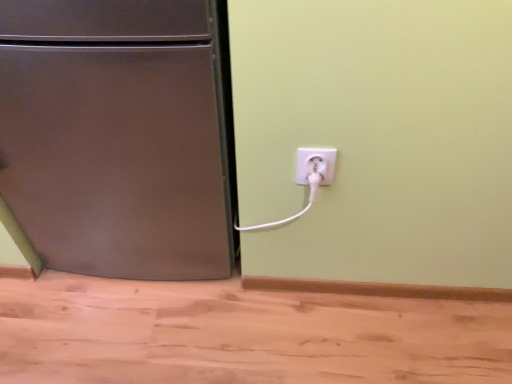
Find the location of a particular element. The height and width of the screenshot is (384, 512). white plastic plug at lower right is located at coordinates (315, 163).

What do you see at coordinates (315, 163) in the screenshot?
I see `white plastic plug at lower right` at bounding box center [315, 163].

Measure the distance between white plastic plug at lower right and camera.

The depth of white plastic plug at lower right is 34.94 inches.

Locate an element on the screen. This screenshot has width=512, height=384. brushed metal refrigerator at left is located at coordinates (116, 136).

Describe the element at coordinates (116, 136) in the screenshot. This screenshot has height=384, width=512. I see `brushed metal refrigerator at left` at that location.

You are a GUI agent. You are given a task and a screenshot of the screen. Output one action in this format:
    pyautogui.click(x=<x>, y=<y>)
    Task: Click on the white plastic plug at lower right
    This screenshot has width=512, height=384.
    Given the screenshot: What is the action you would take?
    pyautogui.click(x=315, y=163)

Based on the photo, can you confirm if brushed metal refrigerator at left is positioned to the right of white plastic plug at lower right?

Incorrect, brushed metal refrigerator at left is not on the right side of white plastic plug at lower right.

Who is more distant, brushed metal refrigerator at left or white plastic plug at lower right?

white plastic plug at lower right.

Does point (174, 182) come in front of point (332, 152)?

No, (174, 182) is behind (332, 152).

From the image's perspective, which one is positioned higher, brushed metal refrigerator at left or white plastic plug at lower right?

brushed metal refrigerator at left appears higher in the image.

From a real-world perspective, which is physically above, brushed metal refrigerator at left or white plastic plug at lower right?

white plastic plug at lower right.

Considering the sizes of objects brushed metal refrigerator at left and white plastic plug at lower right in the image provided, who is thinner, brushed metal refrigerator at left or white plastic plug at lower right?

white plastic plug at lower right is thinner.

From the picture: From their relative heights in the image, would you say brushed metal refrigerator at left is taller or shorter than white plastic plug at lower right?

Clearly, brushed metal refrigerator at left is taller compared to white plastic plug at lower right.

Based on their sizes in the image, would you say brushed metal refrigerator at left is bigger or smaller than white plastic plug at lower right?

In the image, brushed metal refrigerator at left appears to be larger than white plastic plug at lower right.

Can we say brushed metal refrigerator at left lies outside white plastic plug at lower right?

Absolutely, brushed metal refrigerator at left is external to white plastic plug at lower right.

Does brushed metal refrigerator at left touch white plastic plug at lower right?

No, brushed metal refrigerator at left is not with white plastic plug at lower right.

Does brushed metal refrigerator at left turn towards white plastic plug at lower right?

No, brushed metal refrigerator at left is not aimed at white plastic plug at lower right.

What's the angular difference between brushed metal refrigerator at left and white plastic plug at lower right's facing directions?

The angle between the facing direction of brushed metal refrigerator at left and the facing direction of white plastic plug at lower right is 1.1 degrees.

How distant is brushed metal refrigerator at left from white plastic plug at lower right?

The distance of brushed metal refrigerator at left from white plastic plug at lower right is 16.89 inches.

Where is `refrigerator that appears in front of the white plastic plug at lower right`? refrigerator that appears in front of the white plastic plug at lower right is located at coordinates (116, 136).

Which is more to the left, white plastic plug at lower right or brushed metal refrigerator at left?

From the viewer's perspective, brushed metal refrigerator at left appears more on the left side.

Which object is further away from the camera taking this photo, white plastic plug at lower right or brushed metal refrigerator at left?

Positioned behind is white plastic plug at lower right.

Is point (309, 171) farther from camera compared to point (208, 20)?

Yes, point (309, 171) is farther from viewer.

From the image's perspective, is white plastic plug at lower right located above brushed metal refrigerator at left?

No, from the image's perspective, white plastic plug at lower right is not above brushed metal refrigerator at left.

From a real-world perspective, is white plastic plug at lower right on top of brushed metal refrigerator at left?

Yes, from a real-world perspective, white plastic plug at lower right is on top of brushed metal refrigerator at left.

Which of these two, white plastic plug at lower right or brushed metal refrigerator at left, is thinner?

white plastic plug at lower right is thinner.

Does white plastic plug at lower right have a lesser height compared to brushed metal refrigerator at left?

Yes.

From the picture: Looking at the image, does white plastic plug at lower right seem bigger or smaller compared to brushed metal refrigerator at left?

Clearly, white plastic plug at lower right is smaller in size than brushed metal refrigerator at left.

Is white plastic plug at lower right completely or partially outside of brushed metal refrigerator at left?

Absolutely, white plastic plug at lower right is external to brushed metal refrigerator at left.

Is white plastic plug at lower right not close to brushed metal refrigerator at left?

No, there isn't a large distance between white plastic plug at lower right and brushed metal refrigerator at left.

Is white plastic plug at lower right facing towards brushed metal refrigerator at left?

No, white plastic plug at lower right is not turned towards brushed metal refrigerator at left.

What's the angular difference between white plastic plug at lower right and brushed metal refrigerator at left's facing directions?

There is a 1.1-degree angle between the facing directions of white plastic plug at lower right and brushed metal refrigerator at left.

Measure the distance between white plastic plug at lower right and brushed metal refrigerator at left.

They are 42.91 centimeters apart.

I want to click on refrigerator that appears below the white plastic plug at lower right (from a real-world perspective), so click(x=116, y=136).

Image resolution: width=512 pixels, height=384 pixels. In order to click on refrigerator to the left of white plastic plug at lower right in this screenshot , I will do `click(116, 136)`.

The width and height of the screenshot is (512, 384). Find the location of `power plugs and sockets behind the brushed metal refrigerator at left`. power plugs and sockets behind the brushed metal refrigerator at left is located at coordinates pos(315,163).